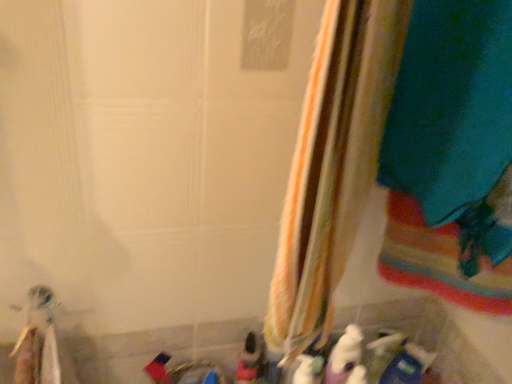
This screenshot has width=512, height=384. Find the location of `white plastic toothbrush at lower left, the first toy from the left`. white plastic toothbrush at lower left, the first toy from the left is located at coordinates (37, 342).

Where is `matte plastic toy at lower center, acting as the 2th toy starting from the left`? matte plastic toy at lower center, acting as the 2th toy starting from the left is located at coordinates (249, 361).

The height and width of the screenshot is (384, 512). Describe the element at coordinates (382, 353) in the screenshot. I see `white matte bottle at lower center, which is the fourth toy in left-to-right order` at that location.

The width and height of the screenshot is (512, 384). Describe the element at coordinates (408, 365) in the screenshot. I see `blue plastic toy at lower right, the first toy in the right-to-left sequence` at that location.

Where is `blue plastic toy at lower right, the first toy in the right-to-left sequence`? Image resolution: width=512 pixels, height=384 pixels. blue plastic toy at lower right, the first toy in the right-to-left sequence is located at coordinates (408, 365).

Image resolution: width=512 pixels, height=384 pixels. I want to click on white plastic toothbrush at lower left, which ranks as the fifth toy in right-to-left order, so click(x=37, y=342).

Is blue plastic toy at lower right, which is the fifth toy from left to right, facing towards white plush toy at lower center, marked as the 3th toy in a left-to-right arrangement?

No, blue plastic toy at lower right, which is the fifth toy from left to right, is not facing towards white plush toy at lower center, marked as the 3th toy in a left-to-right arrangement.

Is blue plastic toy at lower right, which is the fifth toy from left to right, at the right side of white plush toy at lower center, which is the 3th toy from right to left?

Correct, you'll find blue plastic toy at lower right, which is the fifth toy from left to right, to the right of white plush toy at lower center, which is the 3th toy from right to left.

How much distance is there between blue plastic toy at lower right, which is the fifth toy from left to right, and white plush toy at lower center, which is the 3th toy from right to left?

blue plastic toy at lower right, which is the fifth toy from left to right, and white plush toy at lower center, which is the 3th toy from right to left, are 4.71 inches apart.

From the picture: Are blue plastic toy at lower right, the first toy in the right-to-left sequence, and white plush toy at lower center, which is the 3th toy from right to left, located far from each other?

blue plastic toy at lower right, the first toy in the right-to-left sequence, is near white plush toy at lower center, which is the 3th toy from right to left, not far away.

How many degrees apart are the facing directions of white plastic toothbrush at lower left, which ranks as the fifth toy in right-to-left order, and striped fabric curtain at center?

They differ by 56.3 degrees in their facing directions.

From the image's perspective, would you say white plastic toothbrush at lower left, the first toy from the left, is shown under striped fabric curtain at center?

Yes.

Does point (45, 344) come in front of point (337, 252)?

No.

Is white plastic toothbrush at lower left, which ranks as the fifth toy in right-to-left order, further to the viewer compared to striped fabric curtain at center?

That is True.

From the image's perspective, is blue plastic toy at lower right, the first toy in the right-to-left sequence, located beneath matte plastic toy at lower center, acting as the 2th toy starting from the left?

Yes, from the image's perspective, blue plastic toy at lower right, the first toy in the right-to-left sequence, is below matte plastic toy at lower center, acting as the 2th toy starting from the left.

Which toy is the 3rd one when counting from the left side of the blue plastic toy at lower right, which is the fifth toy from left to right? Please provide its 2D coordinates.

[(249, 361)]

Considering the relative sizes of blue plastic toy at lower right, the first toy in the right-to-left sequence, and matte plastic toy at lower center, acting as the 4th toy starting from the right, in the image provided, is blue plastic toy at lower right, the first toy in the right-to-left sequence, thinner than matte plastic toy at lower center, acting as the 4th toy starting from the right,?

Indeed, blue plastic toy at lower right, the first toy in the right-to-left sequence, has a lesser width compared to matte plastic toy at lower center, acting as the 4th toy starting from the right.

Is blue plastic toy at lower right, the first toy in the right-to-left sequence, surrounding matte plastic toy at lower center, acting as the 2th toy starting from the left?

No, blue plastic toy at lower right, the first toy in the right-to-left sequence, does not contain matte plastic toy at lower center, acting as the 2th toy starting from the left.

Consider the image. Considering the sizes of striped fabric curtain at center and white matte bottle at lower center, which is the fourth toy in left-to-right order, in the image, is striped fabric curtain at center bigger or smaller than white matte bottle at lower center, which is the fourth toy in left-to-right order,?

Considering their sizes, striped fabric curtain at center takes up more space than white matte bottle at lower center, which is the fourth toy in left-to-right order.

From a real-world perspective, which object stands above the other?

From a 3D spatial view, striped fabric curtain at center is above.

Considering the positions of point (54, 383) and point (357, 354), is point (54, 383) closer or farther from the camera than point (357, 354)?

Point (54, 383) appears to be closer to the viewer than point (357, 354).

Is white plastic toothbrush at lower left, the first toy from the left, not inside white plush toy at lower center, marked as the 3th toy in a left-to-right arrangement?

Yes, white plastic toothbrush at lower left, the first toy from the left, is located beyond the bounds of white plush toy at lower center, marked as the 3th toy in a left-to-right arrangement.

Which object is positioned more to the left, white plastic toothbrush at lower left, the first toy from the left, or white plush toy at lower center, which is the 3th toy from right to left?

Positioned to the left is white plastic toothbrush at lower left, the first toy from the left.

Which object is closer to the camera taking this photo, white plastic toothbrush at lower left, which ranks as the fifth toy in right-to-left order, or white plush toy at lower center, marked as the 3th toy in a left-to-right arrangement?

white plastic toothbrush at lower left, which ranks as the fifth toy in right-to-left order, is more forward.

Does white matte bottle at lower center, which is the fourth toy in left-to-right order, come behind white plastic toothbrush at lower left, which ranks as the fifth toy in right-to-left order?

Yes, it is behind white plastic toothbrush at lower left, which ranks as the fifth toy in right-to-left order.

Can you tell me how much white matte bottle at lower center, which is the fourth toy in left-to-right order, and white plastic toothbrush at lower left, the first toy from the left, differ in facing direction?

The facing directions of white matte bottle at lower center, which is the fourth toy in left-to-right order, and white plastic toothbrush at lower left, the first toy from the left, are 18.3 degrees apart.

From the image's perspective, is white matte bottle at lower center, which is the fourth toy in left-to-right order, located above or below white plastic toothbrush at lower left, which ranks as the fifth toy in right-to-left order?

Clearly, from the image's perspective, white matte bottle at lower center, which is the fourth toy in left-to-right order, is below white plastic toothbrush at lower left, which ranks as the fifth toy in right-to-left order.

How different are the orientations of striped fabric curtain at center and white plastic toothbrush at lower left, which ranks as the fifth toy in right-to-left order, in degrees?

56.3 degrees separate the facing orientations of striped fabric curtain at center and white plastic toothbrush at lower left, which ranks as the fifth toy in right-to-left order.

Looking at the image, does striped fabric curtain at center seem bigger or smaller compared to white plastic toothbrush at lower left, which ranks as the fifth toy in right-to-left order?

Considering their sizes, striped fabric curtain at center takes up more space than white plastic toothbrush at lower left, which ranks as the fifth toy in right-to-left order.

From a real-world perspective, is striped fabric curtain at center positioned above or below white plastic toothbrush at lower left, which ranks as the fifth toy in right-to-left order?

striped fabric curtain at center is above white plastic toothbrush at lower left, which ranks as the fifth toy in right-to-left order.

Could you tell me if striped fabric curtain at center is facing white plastic toothbrush at lower left, the first toy from the left?

No, striped fabric curtain at center is not turned towards white plastic toothbrush at lower left, the first toy from the left.

Locate an element on the screen. the 1st toy below the white plush toy at lower center, which is the 3th toy from right to left (from a real-world perspective) is located at coordinates (408, 365).

The height and width of the screenshot is (384, 512). In order to click on the 1st toy behind the striped fabric curtain at center, counting from the anchor's position in this screenshot , I will do `click(37, 342)`.

Considering their positions, is white matte bottle at lower center, which is the 2th toy in right-to-left order, positioned further to white plush toy at lower center, which is the 3th toy from right to left, than blue plastic toy at lower right, which is the fifth toy from left to right?

blue plastic toy at lower right, which is the fifth toy from left to right, is further to white plush toy at lower center, which is the 3th toy from right to left.

Based on their spatial positions, is blue plastic toy at lower right, the first toy in the right-to-left sequence, or white plastic toothbrush at lower left, which ranks as the fifth toy in right-to-left order, closer to white plush toy at lower center, marked as the 3th toy in a left-to-right arrangement?

Among the two, blue plastic toy at lower right, the first toy in the right-to-left sequence, is located nearer to white plush toy at lower center, marked as the 3th toy in a left-to-right arrangement.

Considering their positions, is white plastic toothbrush at lower left, the first toy from the left, positioned further to white matte bottle at lower center, which is the fourth toy in left-to-right order, than blue plastic toy at lower right, which is the fifth toy from left to right?

Among the two, white plastic toothbrush at lower left, the first toy from the left, is located further to white matte bottle at lower center, which is the fourth toy in left-to-right order.

Considering their positions, is matte plastic toy at lower center, acting as the 4th toy starting from the right, positioned further to striped fabric curtain at center than white plush toy at lower center, which is the 3th toy from right to left?

white plush toy at lower center, which is the 3th toy from right to left.

When comparing their distances from white plush toy at lower center, which is the 3th toy from right to left, does striped fabric curtain at center or white plastic toothbrush at lower left, the first toy from the left, seem closer?

Based on the image, striped fabric curtain at center appears to be nearer to white plush toy at lower center, which is the 3th toy from right to left.

Which object lies nearer to the anchor point white matte bottle at lower center, which is the fourth toy in left-to-right order, white plush toy at lower center, marked as the 3th toy in a left-to-right arrangement, or striped fabric curtain at center?

Among the two, white plush toy at lower center, marked as the 3th toy in a left-to-right arrangement, is located nearer to white matte bottle at lower center, which is the fourth toy in left-to-right order.

From the image, which object appears to be farther from white plastic toothbrush at lower left, which ranks as the fifth toy in right-to-left order, blue plastic toy at lower right, which is the fifth toy from left to right, or matte plastic toy at lower center, acting as the 4th toy starting from the right?

The object further to white plastic toothbrush at lower left, which ranks as the fifth toy in right-to-left order, is blue plastic toy at lower right, which is the fifth toy from left to right.

Based on the photo, looking at the image, which one is located further to blue plastic toy at lower right, the first toy in the right-to-left sequence, white matte bottle at lower center, which is the 2th toy in right-to-left order, or white plush toy at lower center, marked as the 3th toy in a left-to-right arrangement?

Based on the image, white plush toy at lower center, marked as the 3th toy in a left-to-right arrangement, appears to be further to blue plastic toy at lower right, the first toy in the right-to-left sequence.

At what (x,y) coordinates should I click in order to perform the action: click on toy between white plastic toothbrush at lower left, the first toy from the left, and white plush toy at lower center, which is the 3th toy from right to left, from left to right. Please return your answer as a coordinate pair (x, y). The width and height of the screenshot is (512, 384). Looking at the image, I should click on (249, 361).

Locate an element on the screen. toy between matte plastic toy at lower center, acting as the 4th toy starting from the right, and white matte bottle at lower center, which is the 2th toy in right-to-left order, from left to right is located at coordinates (344, 356).

This screenshot has height=384, width=512. In order to click on curtain between white plastic toothbrush at lower left, the first toy from the left, and white plush toy at lower center, which is the 3th toy from right to left, from left to right in this screenshot , I will do `click(332, 166)`.

Locate an element on the screen. The width and height of the screenshot is (512, 384). curtain situated between white plastic toothbrush at lower left, which ranks as the fifth toy in right-to-left order, and white matte bottle at lower center, which is the fourth toy in left-to-right order, from left to right is located at coordinates (332, 166).